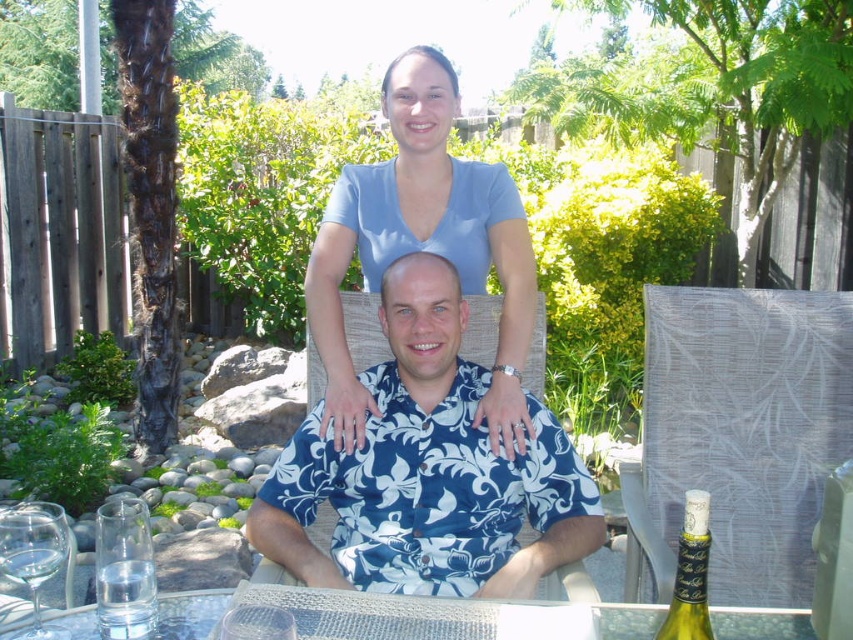
Does blue floral shirt at center have a lesser width compared to clear glass wine glass at lower left?

Incorrect, blue floral shirt at center's width is not less than clear glass wine glass at lower left's.

Is point (426, 540) in front of point (33, 525)?

No, (426, 540) is further to viewer.

Is point (386, 568) behind point (4, 557)?

Yes, point (386, 568) is behind point (4, 557).

Locate an element on the screen. Image resolution: width=853 pixels, height=640 pixels. blue floral shirt at center is located at coordinates (427, 472).

Based on the photo, can you confirm if gray fabric chair at right is shorter than clear glass at lower left?

Incorrect, gray fabric chair at right's height does not fall short of clear glass at lower left's.

Where is `gray fabric chair at right`? gray fabric chair at right is located at coordinates (741, 432).

Locate an element on the screen. gray fabric chair at right is located at coordinates (741, 432).

Is point (788, 520) farther from viewer compared to point (148, 520)?

Yes, it is.

Locate an element on the screen. The height and width of the screenshot is (640, 853). gray fabric chair at right is located at coordinates (741, 432).